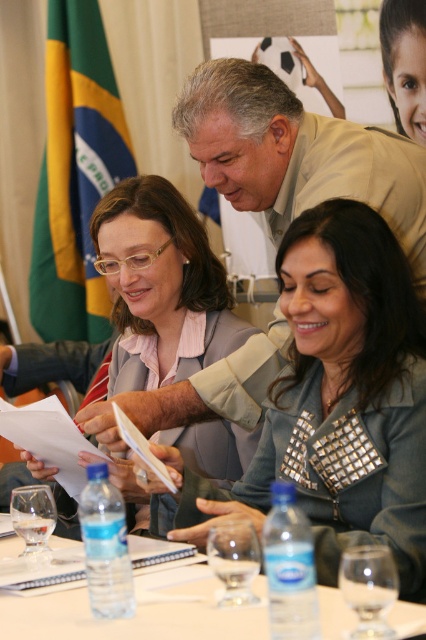
From the picture: Based on the scene described, can you determine if the beige textured suit at upper center is wider than the green fabric flag at upper left?

The beige textured suit at upper center might be wider than green fabric flag at upper left according to the description.

What is the color and texture of the clothing item located at point (x=296, y=154) in the image?

The clothing item at point (x=296, y=154) is beige in color and has a textured surface.

You are an event planner observing the group in the image. You need to determine which clothing item is taller between the matte gray blazer at center and the beige textured suit at upper center without directly measuring them. How can you use their positions in the scene to infer this?

The matte gray blazer at center has a greater height compared to the beige textured suit at upper center, so the matte gray blazer at center is taller.